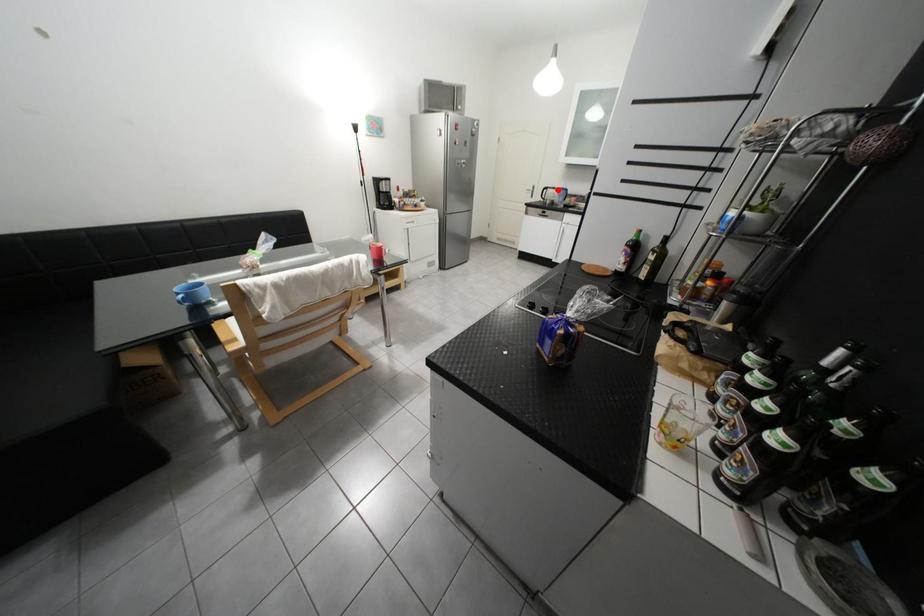
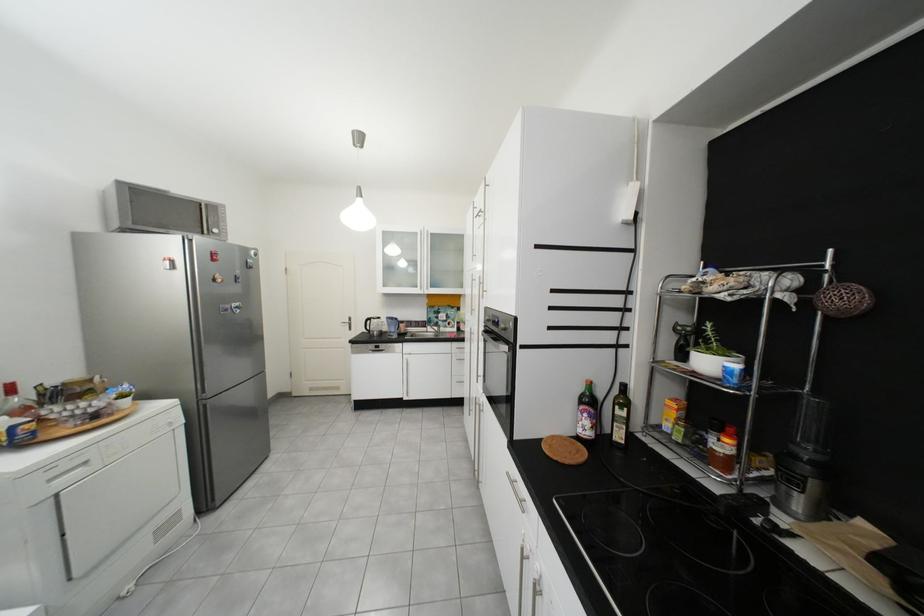
Question: I am providing you with two images of the same scene from different viewpoints. A red point is shown in image1. For the corresponding object point in image2, is it positioned nearer or farther from the camera?

Choices:
 (A) Nearer
 (B) Farther

Answer: (B)